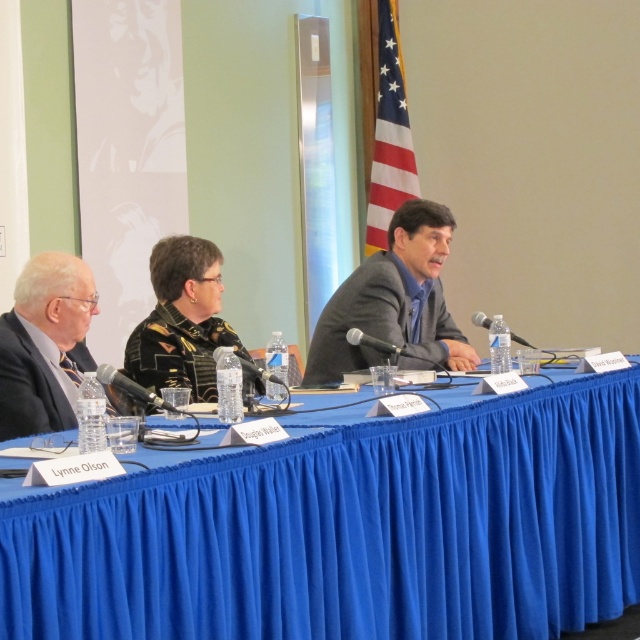
Who is shorter, blue fabric table at center or black leather jacket at center?

black leather jacket at center is shorter.

Can you confirm if blue fabric table at center is bigger than black leather jacket at center?

Indeed, blue fabric table at center has a larger size compared to black leather jacket at center.

Does point (276, 637) come in front of point (220, 257)?

Yes, it is in front of point (220, 257).

You are a GUI agent. You are given a task and a screenshot of the screen. Output one action in this format:
    pyautogui.click(x=<x>, y=<y>)
    Task: Click on the blue fabric table at center
    
    Given the screenshot: What is the action you would take?
    pyautogui.click(x=352, y=531)

How much distance is there between blue fabric table at center and matte black suit at left?

A distance of 1.24 meters exists between blue fabric table at center and matte black suit at left.

Between blue fabric table at center and matte black suit at left, which one has less height?

matte black suit at left

This screenshot has width=640, height=640. Identify the location of blue fabric table at center. (352, 531).

Between gray suit at center and matte black suit at left, which one has less height?

matte black suit at left is shorter.

Which is more to the right, gray suit at center or matte black suit at left?

Positioned to the right is gray suit at center.

Between point (316, 364) and point (92, 276), which one is positioned in front?

Point (92, 276) is more forward.

I want to click on gray suit at center, so click(x=394, y=301).